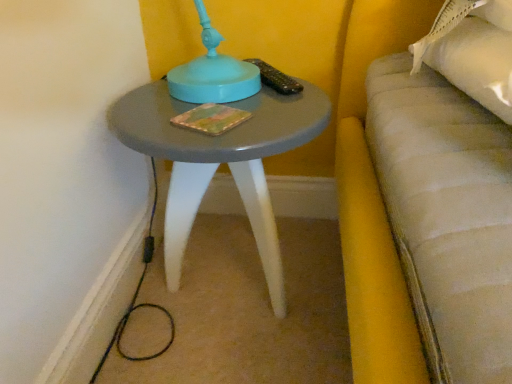
Question: From the image's perspective, relative to multicolored textured book at center, is matte gray table at center above or below?

Choices:
 (A) above
 (B) below

Answer: (B)

Question: Is matte gray table at center wider or thinner than multicolored textured book at center?

Choices:
 (A) thin
 (B) wide

Answer: (B)

Question: Is matte gray table at center in front of or behind multicolored textured book at center in the image?

Choices:
 (A) front
 (B) behind

Answer: (A)

Question: Relative to matte gray table at center, is multicolored textured book at center in front or behind?

Choices:
 (A) behind
 (B) front

Answer: (A)

Question: From a real-world perspective, relative to matte gray table at center, is multicolored textured book at center vertically above or below?

Choices:
 (A) below
 (B) above

Answer: (B)

Question: Looking at the image, does multicolored textured book at center seem bigger or smaller compared to matte gray table at center?

Choices:
 (A) small
 (B) big

Answer: (A)

Question: Considering the positions of multicolored textured book at center and matte gray table at center in the image, is multicolored textured book at center wider or thinner than matte gray table at center?

Choices:
 (A) thin
 (B) wide

Answer: (A)